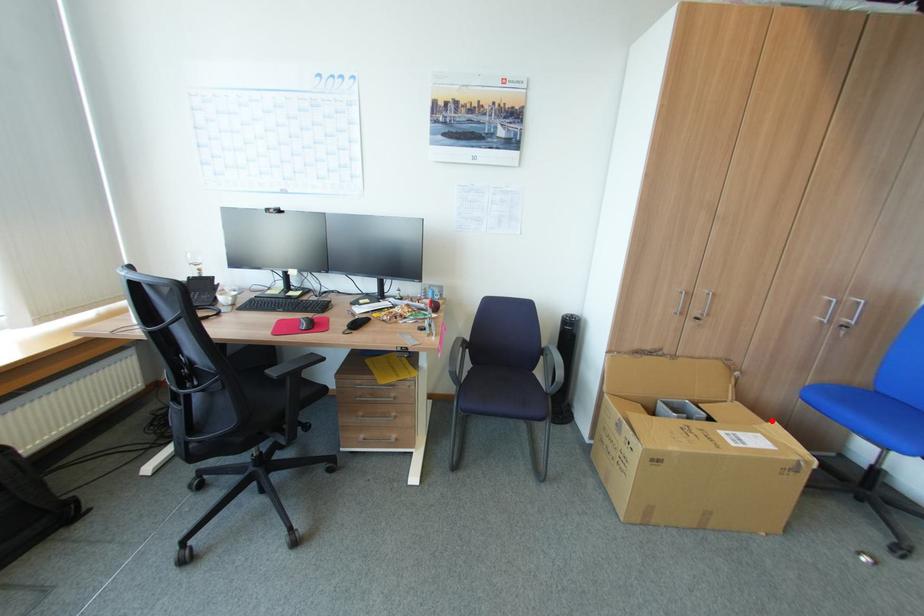
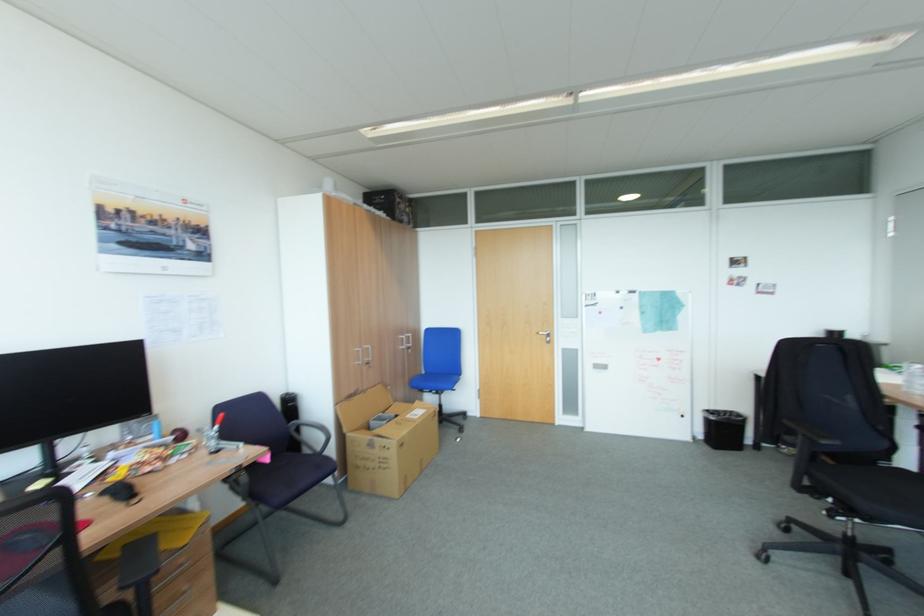
Question: I am providing you with two images of the same scene from different viewpoints. A red point is shown in image1. For the corresponding object point in image2, is it positioned nearer or farther from the camera?

Choices:
 (A) Nearer
 (B) Farther

Answer: (A)